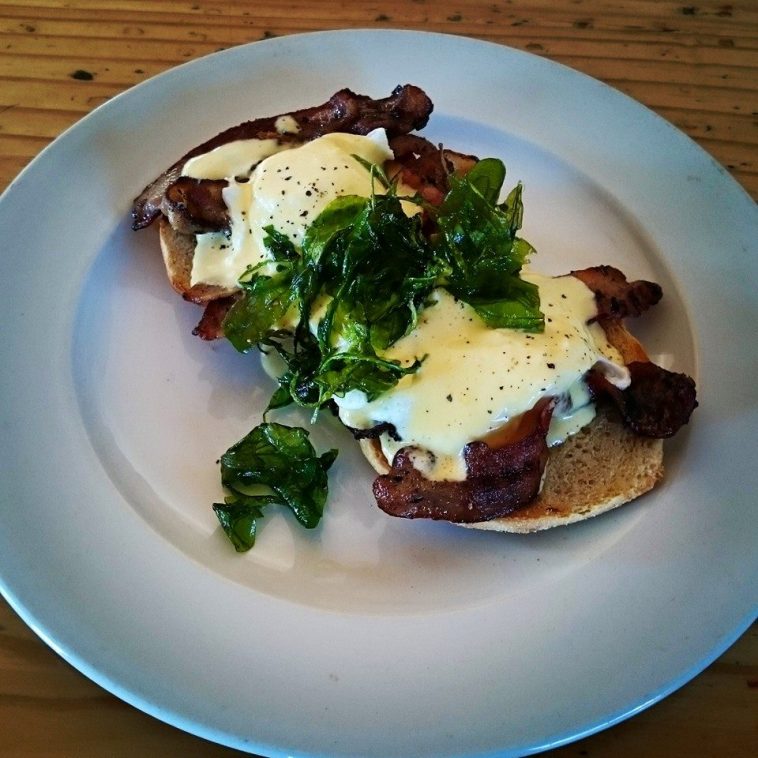
Locate an element on the screen. This screenshot has width=758, height=758. clean plate is located at coordinates (151, 384).